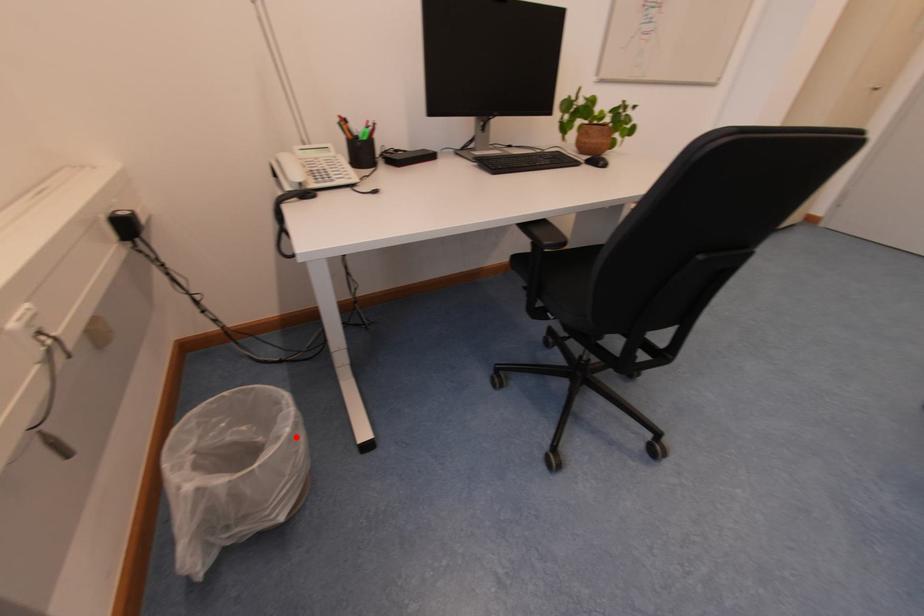
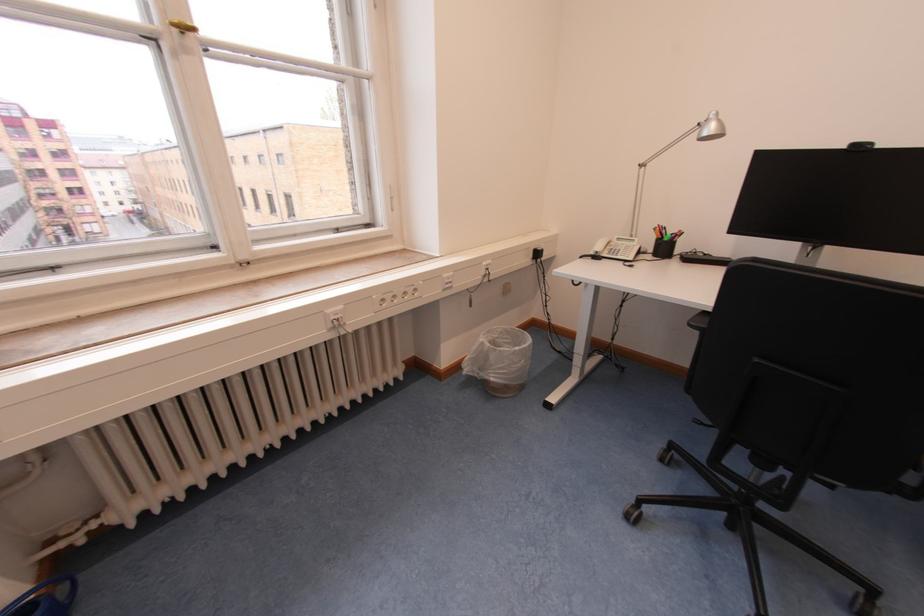
Question: A red point is marked in image1. In image2, is the corresponding 3D point closer to the camera or farther? Reply with the corresponding letter.

Choices:
 (A) The corresponding 3D point is closer.
 (B) The corresponding 3D point is farther.

Answer: (A)